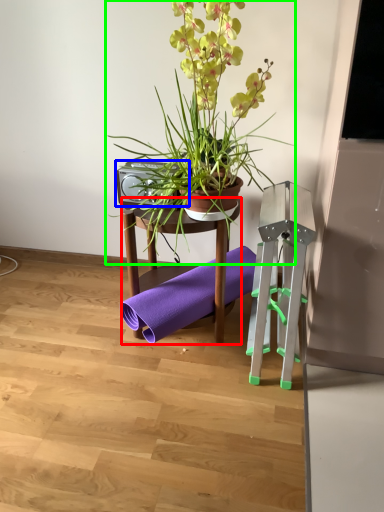
Question: Considering the real-world distances, which object is closest to furniture (highlighted by a red box)? speaker (highlighted by a blue box) or houseplant (highlighted by a green box).

Choices:
 (A) speaker
 (B) houseplant

Answer: (A)